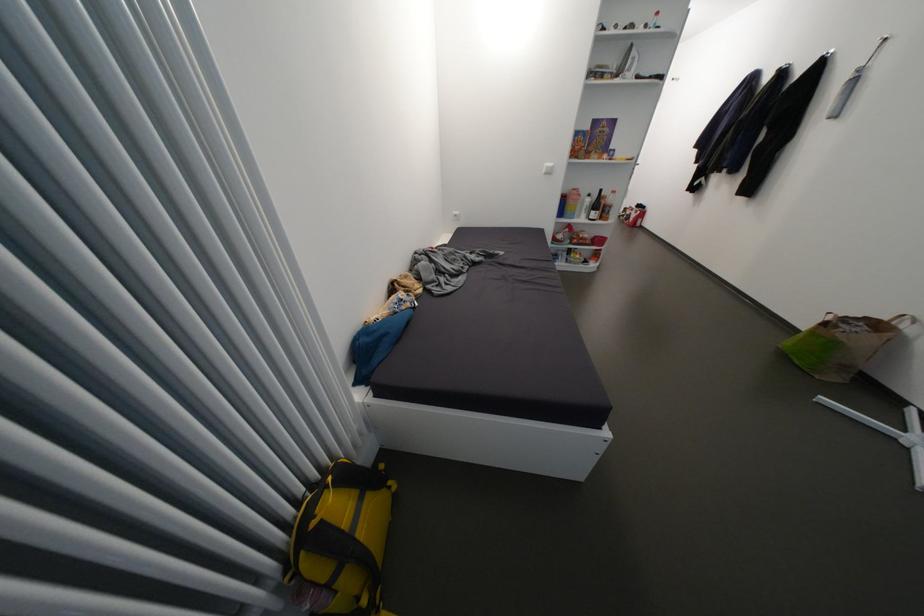
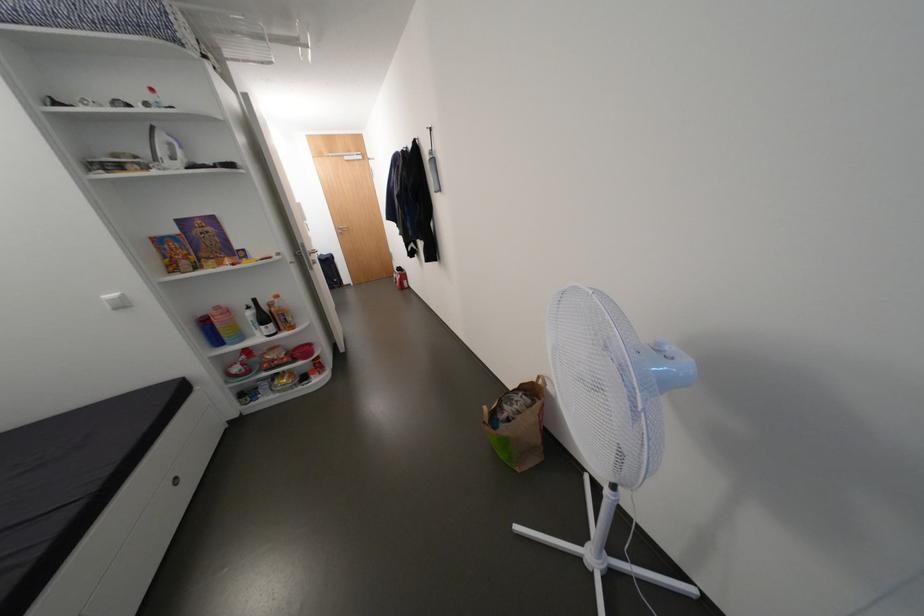
Find the pixel in the second image that matches (872,318) in the first image.

(529, 386)